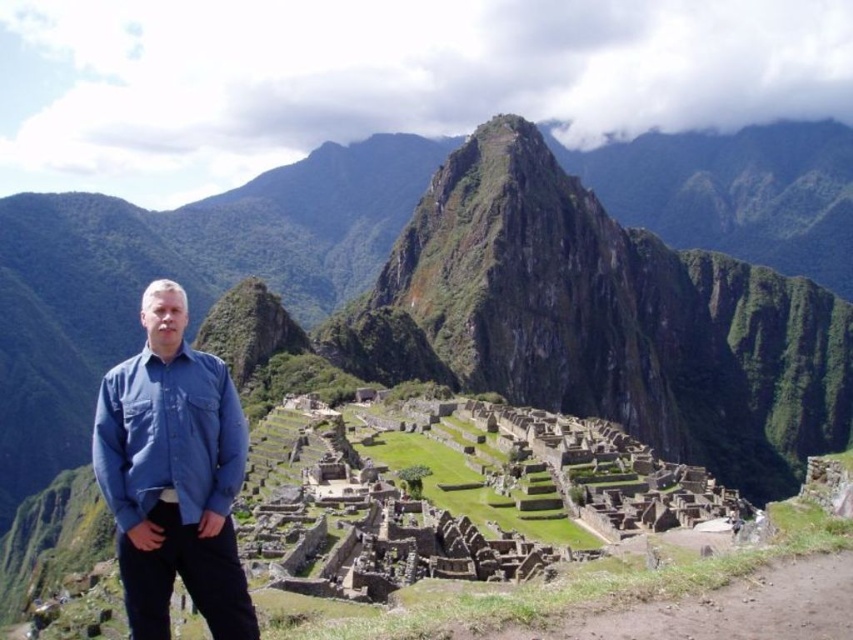
Does green grassy mountain at center have a lesser width compared to blue cotton shirt at left?

No, green grassy mountain at center is not thinner than blue cotton shirt at left.

Is point (44, 296) farther from camera compared to point (164, 612)?

Yes, it is.

This screenshot has height=640, width=853. I want to click on green grassy mountain at center, so click(175, 275).